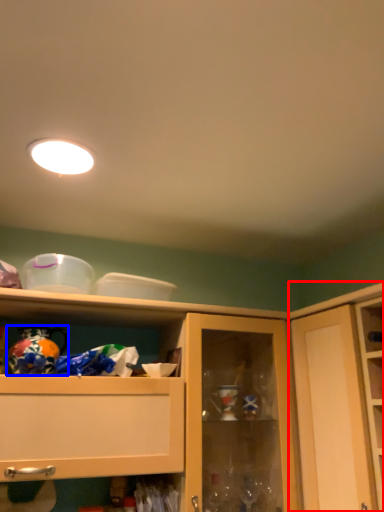
Question: Which of the following is the farthest to the observer, cupboard (highlighted by a red box) or toy (highlighted by a blue box)?

Choices:
 (A) cupboard
 (B) toy

Answer: (B)